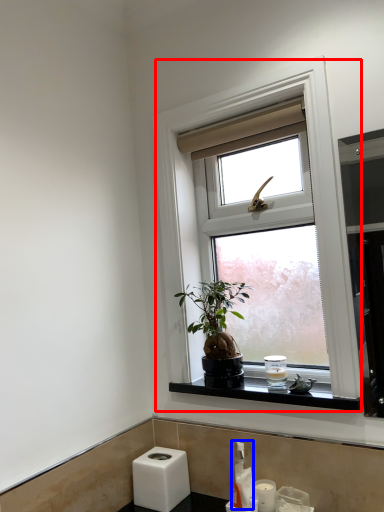
Question: Which object is further to the camera taking this photo, window (highlighted by a red box) or soap dispenser (highlighted by a blue box)?

Choices:
 (A) window
 (B) soap dispenser

Answer: (B)